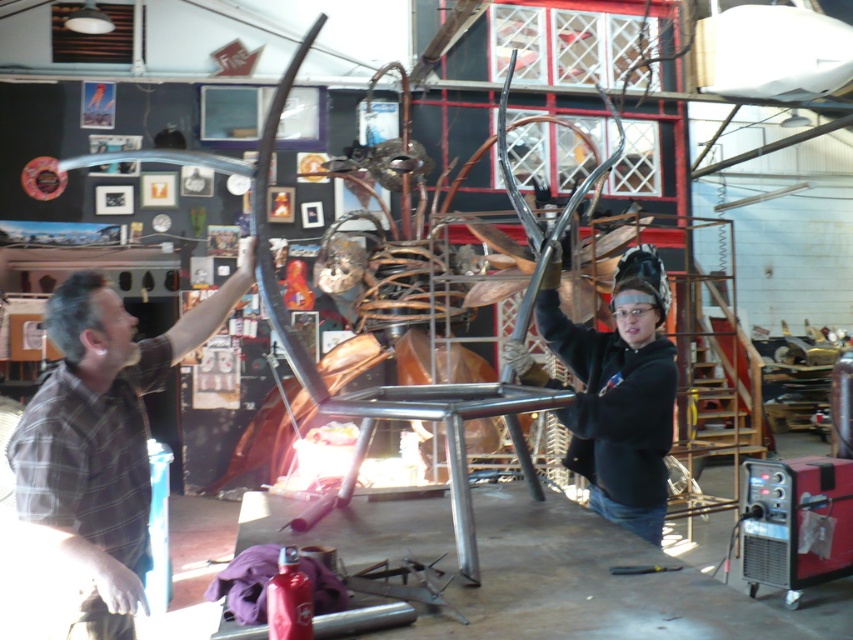
Which is more to the left, brown plaid shirt at left or black matte welding helmet at upper center?

From the viewer's perspective, brown plaid shirt at left appears more on the left side.

In the scene shown: Is brown plaid shirt at left smaller than black matte welding helmet at upper center?

Incorrect, brown plaid shirt at left is not smaller in size than black matte welding helmet at upper center.

Is point (61, 406) positioned behind point (663, 426)?

No, it is in front of (663, 426).

The width and height of the screenshot is (853, 640). Find the location of `brown plaid shirt at left`. brown plaid shirt at left is located at coordinates (102, 442).